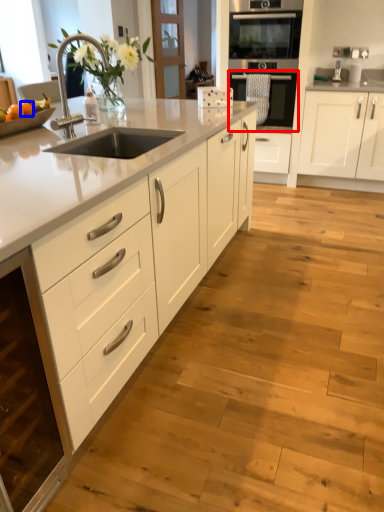
Question: Which point is closer to the camera, oven (highlighted by a red box) or orange (highlighted by a blue box)?

Choices:
 (A) oven
 (B) orange

Answer: (B)